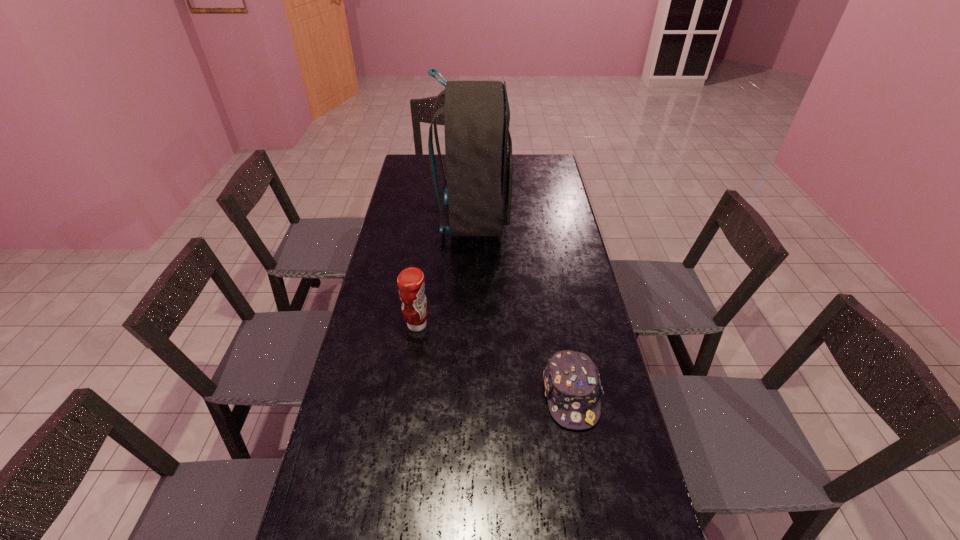
Where is `object that is at the right edge`? The height and width of the screenshot is (540, 960). object that is at the right edge is located at coordinates (572, 384).

The image size is (960, 540). Find the location of `vacant position at the left edge of the desktop`. vacant position at the left edge of the desktop is located at coordinates (356, 368).

Locate an element on the screen. This screenshot has height=540, width=960. blank area at the right edge is located at coordinates (604, 415).

Identify the location of vacant space at the far right corner of the desktop. The width and height of the screenshot is (960, 540). (543, 167).

What are the coordinates of `unoccupied position between the tallest object and the headwear` in the screenshot? It's located at (522, 307).

Where is `vacant space that is in between the second shortest object and the nearest object`? vacant space that is in between the second shortest object and the nearest object is located at coordinates (494, 360).

At what (x,y) coordinates should I click in order to perform the action: click on empty space that is in between the backpack and the rightmost object. Please return your answer as a coordinate pair (x, y). This screenshot has width=960, height=540. Looking at the image, I should click on (522, 307).

At what (x,y) coordinates should I click in order to perform the action: click on empty space that is in between the headwear and the tallest object. Please return your answer as a coordinate pair (x, y). This screenshot has width=960, height=540. Looking at the image, I should click on (522, 307).

Select which object appears as the closest to the condiment. Please provide its 2D coordinates. Your answer should be formatted as a tuple, i.e. [(x, y)], where the tuple contains the x and y coordinates of a point satisfying the conditions above.

[(572, 384)]

Identify the location of the second closest object to the condiment. The height and width of the screenshot is (540, 960). (478, 147).